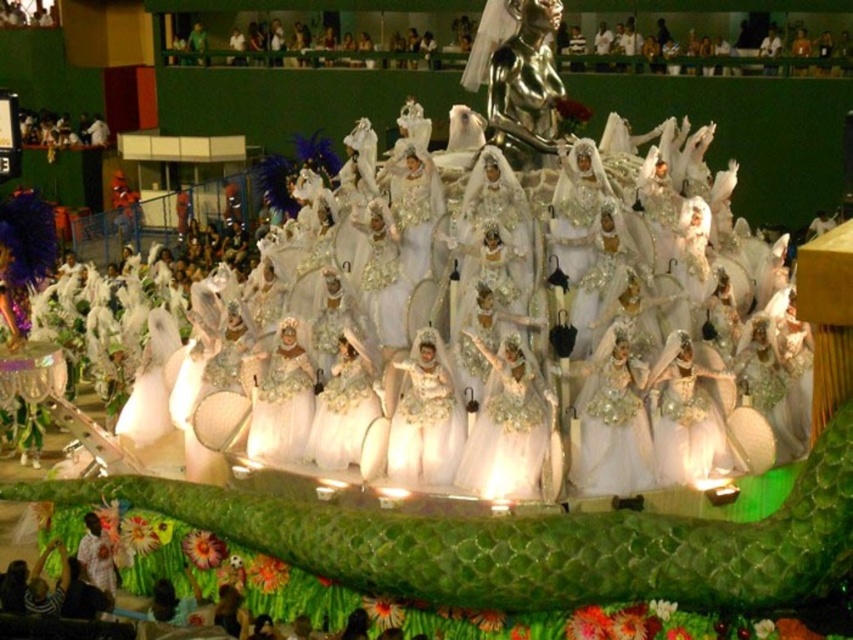
Question: Which object is closer to the camera taking this photo?

Choices:
 (A) white tulle dress at center
 (B) ivory satin dress at center

Answer: (A)

Question: Which point is closer to the camera?

Choices:
 (A) (511, 355)
 (B) (433, 397)

Answer: (A)

Question: Is white tulle dress at center closer to the viewer compared to ivory satin dress at center?

Choices:
 (A) no
 (B) yes

Answer: (B)

Question: Is white tulle dress at center bigger than ivory satin dress at center?

Choices:
 (A) yes
 (B) no

Answer: (B)

Question: Is the position of white tulle dress at center more distant than that of ivory satin dress at center?

Choices:
 (A) no
 (B) yes

Answer: (A)